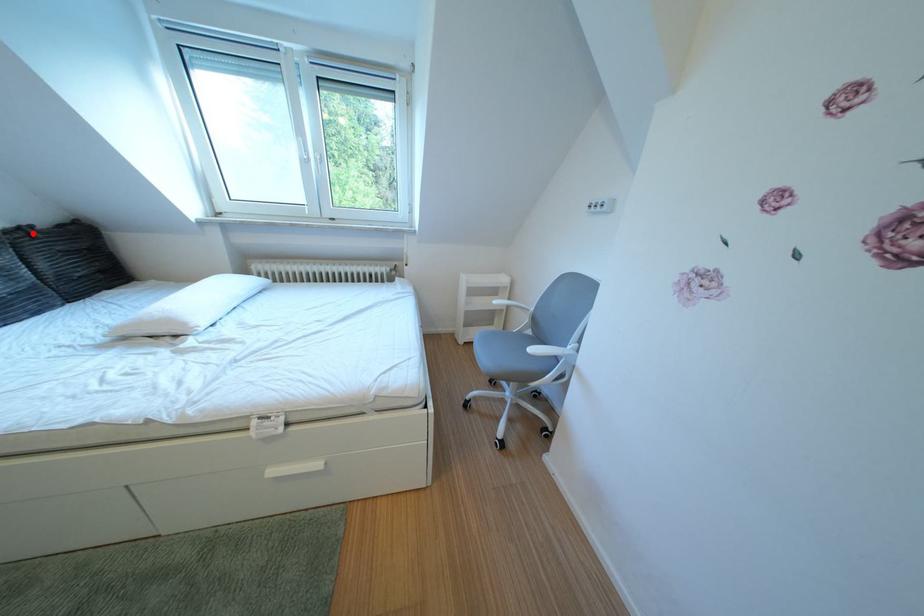
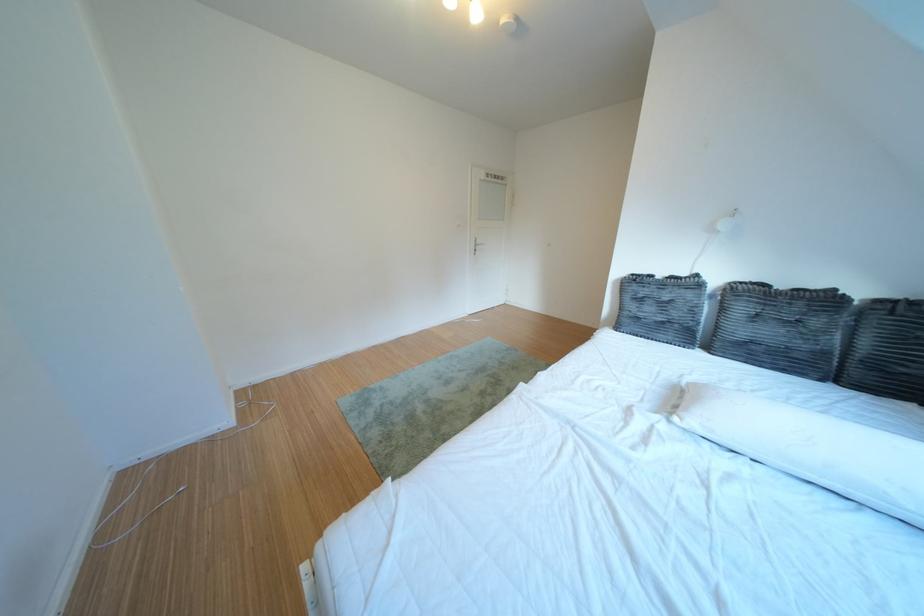
Where in the second image is the point corresponding to the highlighted location from the first image?

(910, 306)